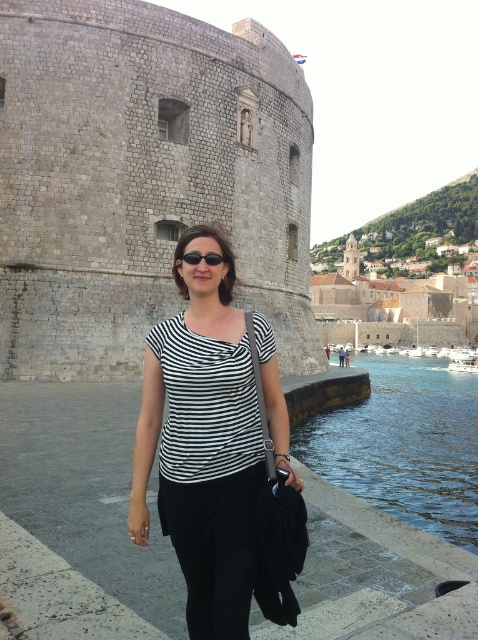
You are a photographer trying to capture the statue in the niche of the large stone structure. You notice two points marked in the scene. One is at coordinate point (271, 88) and the other is at point (218, 250). Which point is closer to the statue?

Point (218, 250) is closer to the statue because it is closer to the camera than point (271, 88), meaning it is physically nearer to the statue located on the stone structure.

You are a tourist standing at the waterfront and want to take a photo of the gray stone castle at center and the clear blue water at lower right. Which object should you focus on first if you want to capture both in a single frame without moving the camera?

The gray stone castle at center is taller than the clear blue water at lower right, so you should focus on the gray stone castle at center first to ensure it fits within the frame.